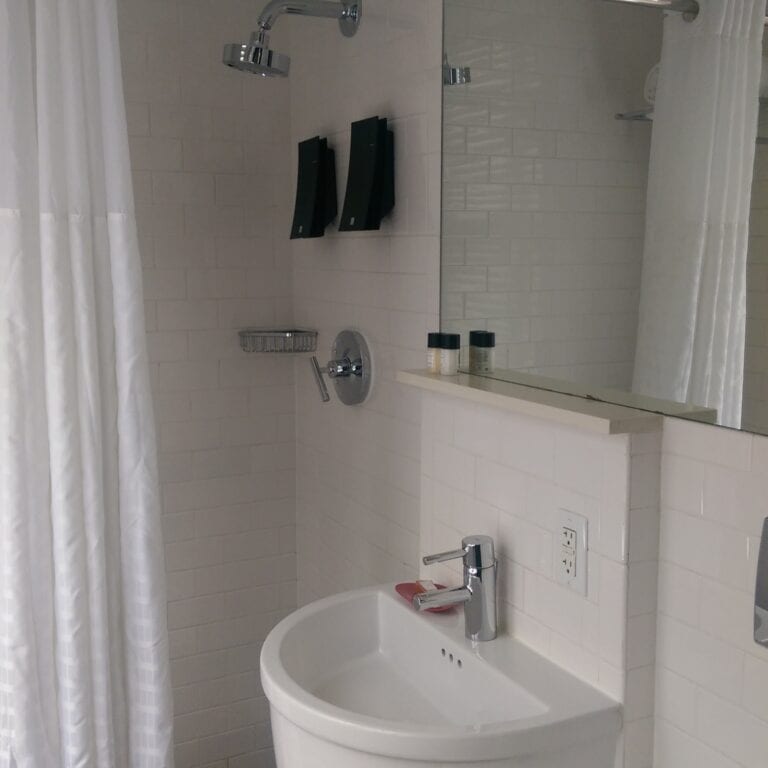
You are a GUI agent. You are given a task and a screenshot of the screen. Output one action in this format:
    pyautogui.click(x=<x>, y=<y>)
    Task: Click on the silver basket
    Image resolution: width=768 pixels, height=768 pixels.
    Given the screenshot: What is the action you would take?
    pyautogui.click(x=283, y=342)